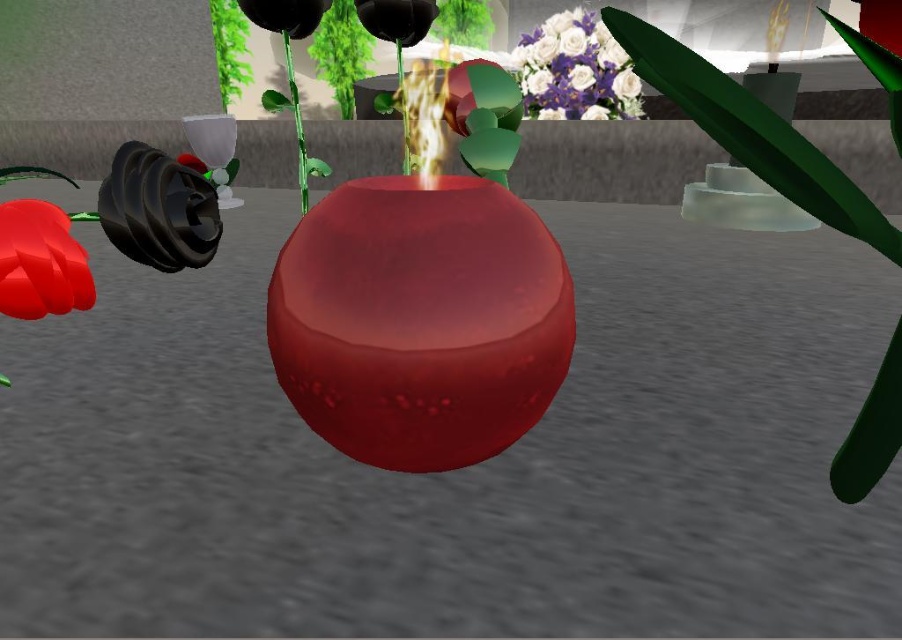
You are arranging flowers in a room and see the glossy ceramic vase at upper center and the matte red flower at lower left. Which object is located to the right of the other?

The glossy ceramic vase at upper center is positioned on the right side of matte red flower at lower left.